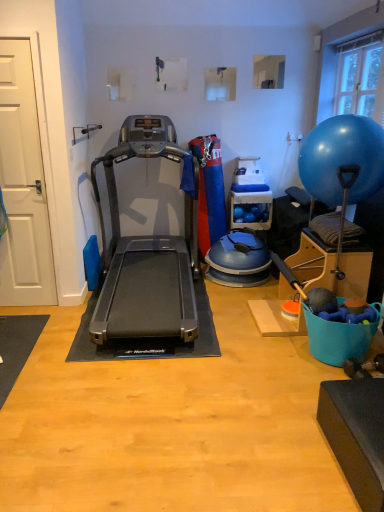
Image resolution: width=384 pixels, height=512 pixels. I want to click on vacant space to the right of white matte door at left, so click(x=58, y=309).